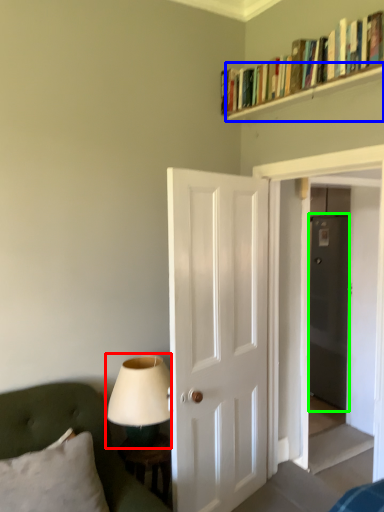
Question: Which object is positioned closest to table lamp (highlighted by a red box)? Select from shelf (highlighted by a blue box) and glass door (highlighted by a green box).

Choices:
 (A) shelf
 (B) glass door

Answer: (A)